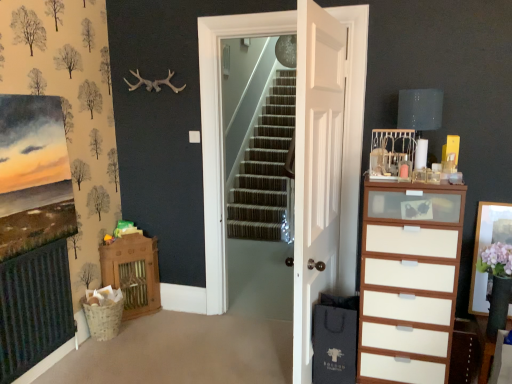
Question: From a real-world perspective, is matte gray lampshade at upper right positioned under wooden cabinet at left based on gravity?

Choices:
 (A) no
 (B) yes

Answer: (A)

Question: Is matte gray lampshade at upper right positioned with its back to wooden cabinet at left?

Choices:
 (A) no
 (B) yes

Answer: (A)

Question: Considering the relative sizes of matte gray lampshade at upper right and wooden cabinet at left in the image provided, is matte gray lampshade at upper right bigger than wooden cabinet at left?

Choices:
 (A) yes
 (B) no

Answer: (B)

Question: Is matte gray lampshade at upper right at the left side of wooden cabinet at left?

Choices:
 (A) yes
 (B) no

Answer: (B)

Question: Does matte gray lampshade at upper right have a greater height compared to wooden cabinet at left?

Choices:
 (A) yes
 (B) no

Answer: (B)

Question: Is matte gray lampshade at upper right to the right of wooden cabinet at left from the viewer's perspective?

Choices:
 (A) yes
 (B) no

Answer: (A)

Question: Does white wooden door at center, positioned as the first door in back-to-front order, lie in front of white wooden door at center, placed as the 1th door when sorted from front to back?

Choices:
 (A) yes
 (B) no

Answer: (B)

Question: Does white wooden door at center, positioned as the first door in back-to-front order, have a smaller size compared to white wooden door at center, the 2th door from the back?

Choices:
 (A) no
 (B) yes

Answer: (A)

Question: Is white wooden door at center, the 2th door positioned from the front, bigger than white wooden door at center, placed as the 1th door when sorted from front to back?

Choices:
 (A) yes
 (B) no

Answer: (A)

Question: Does white wooden door at center, positioned as the first door in back-to-front order, appear on the right side of white wooden door at center, placed as the 1th door when sorted from front to back?

Choices:
 (A) no
 (B) yes

Answer: (A)

Question: Is white wooden door at center, the 2th door positioned from the front, not within white wooden door at center, the 2th door from the back?

Choices:
 (A) no
 (B) yes

Answer: (B)

Question: From the image's perspective, is white wooden door at center, the 2th door positioned from the front, located above white wooden door at center, the 2th door from the back?

Choices:
 (A) yes
 (B) no

Answer: (A)

Question: Considering the relative sizes of white wood chest of drawers at right and matte gray lampshade at upper right in the image provided, is white wood chest of drawers at right wider than matte gray lampshade at upper right?

Choices:
 (A) no
 (B) yes

Answer: (B)